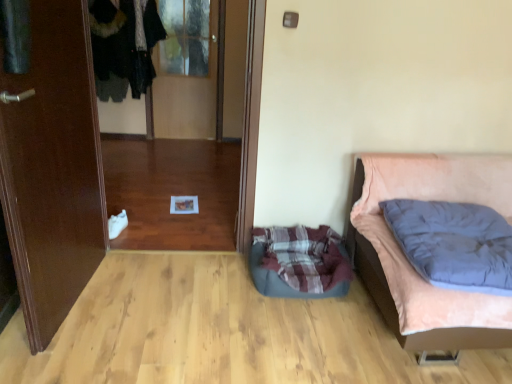
Where is `vacant space in between brown wooden door at left and plaid fabric dog bed at lower center`? vacant space in between brown wooden door at left and plaid fabric dog bed at lower center is located at coordinates [174, 294].